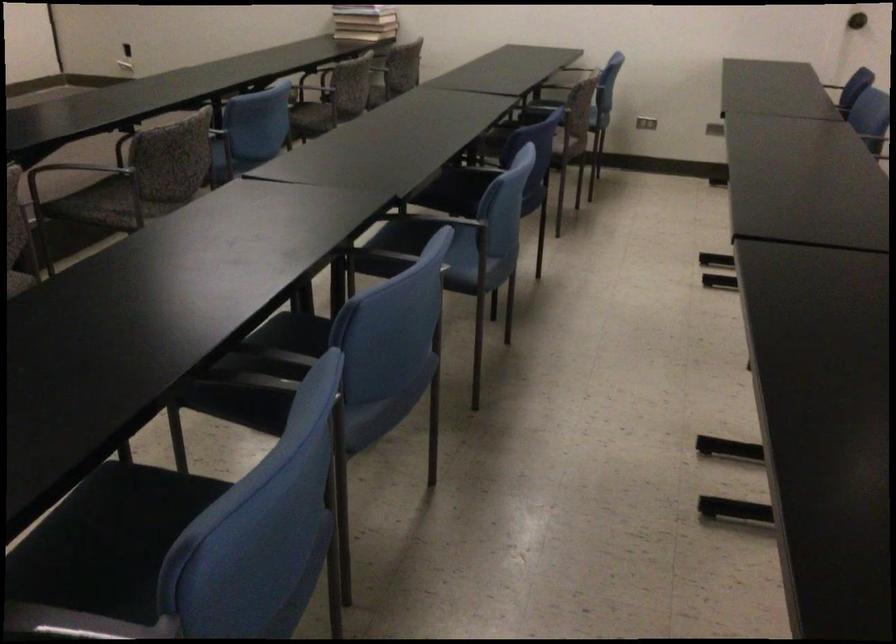
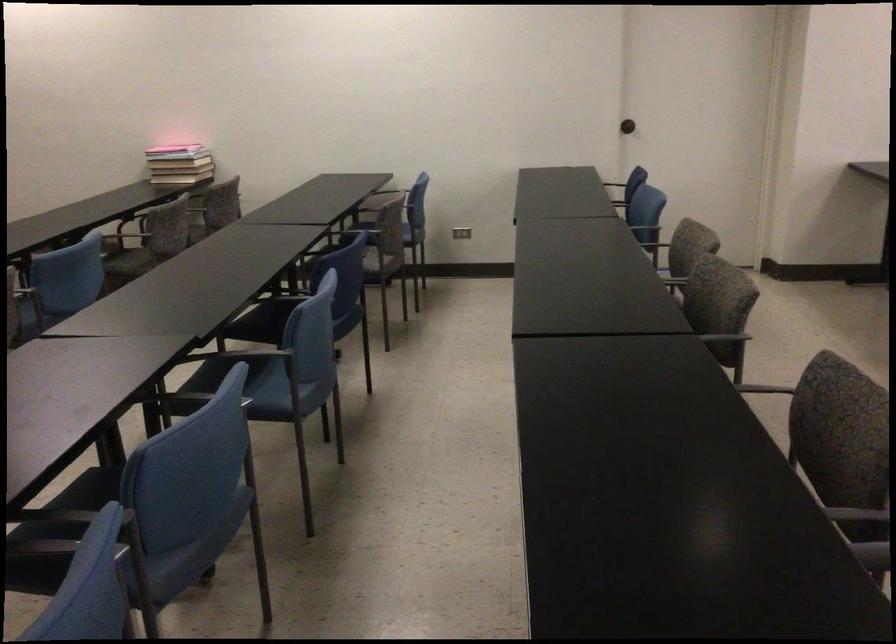
Locate, in the second image, the point that corresponds to [402,67] in the first image.

(221, 204)